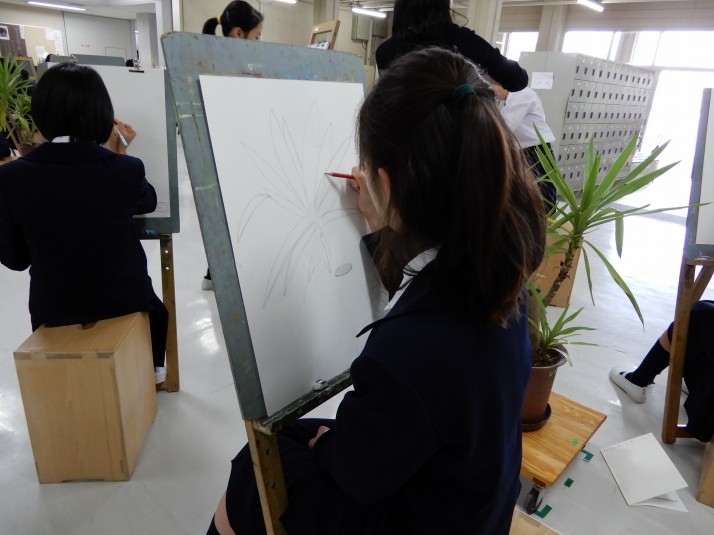
This screenshot has width=714, height=535. I want to click on lockers, so coord(590,114), coord(580,79), coord(652,80), coord(622,111), coord(595,159), coord(572,131).